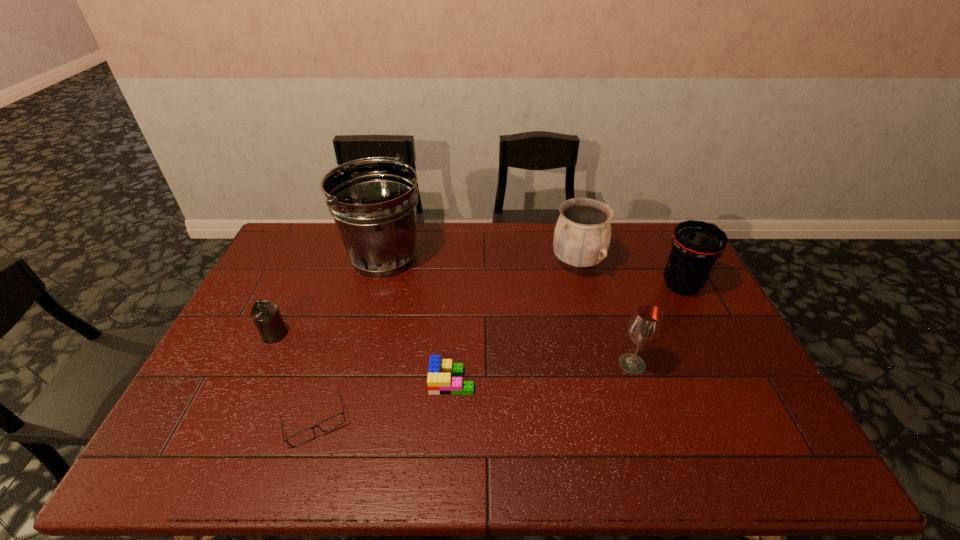
Locate an element on the screen. vacant space located 0.400m on the front of the telephoto lens is located at coordinates (747, 413).

This screenshot has width=960, height=540. I want to click on vacant region located on the left of the wineglass, so click(594, 364).

You are a GUI agent. You are given a task and a screenshot of the screen. Output one action in this format:
    pyautogui.click(x=<x>, y=<y>)
    Task: Click on the free space located 0.100m on the right of the fifth tallest object
    This screenshot has height=540, width=960.
    Given the screenshot: What is the action you would take?
    point(321,334)

Locate an element on the screen. free space located on the right of the Lego is located at coordinates (549, 381).

You are a GUI agent. You are given a task and a screenshot of the screen. Output one action in this format:
    pyautogui.click(x=<x>, y=<y>)
    Task: Click on the vacant space located with the lenses facing outward on the nearest object
    This screenshot has height=540, width=960.
    Given the screenshot: What is the action you would take?
    [x=300, y=470]

Identify the location of bucket located at the far edge. The width and height of the screenshot is (960, 540). (x=373, y=201).

Identify the location of urn that is at the far edge. Image resolution: width=960 pixels, height=540 pixels. (582, 235).

The image size is (960, 540). Find the location of `object that is at the near edge`. object that is at the near edge is located at coordinates (332, 422).

Locate an element on the screen. Image resolution: width=960 pixels, height=540 pixels. object that is at the left edge is located at coordinates (266, 316).

What are the coordinates of `object present at the right edge` in the screenshot? It's located at (696, 244).